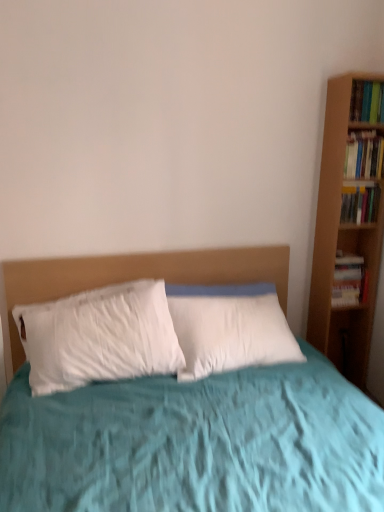
This screenshot has height=512, width=384. Find the location of `vacant location below hardcover book at right, which is the second book in bottom-to-top order (from a real-world perspective)`. vacant location below hardcover book at right, which is the second book in bottom-to-top order (from a real-world perspective) is located at coordinates (350, 256).